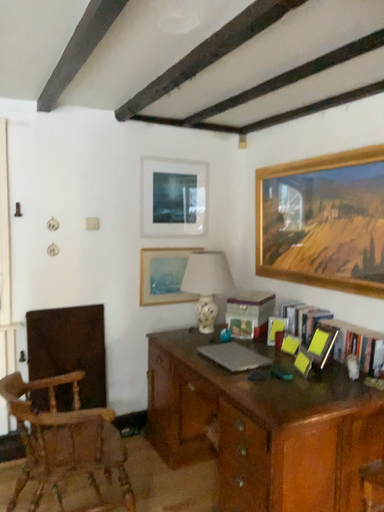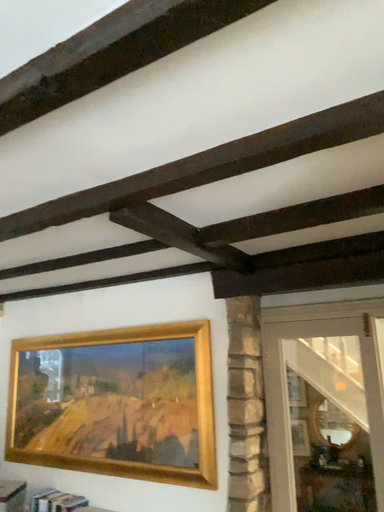
Question: Which way did the camera rotate in the video?

Choices:
 (A) rotated downward
 (B) rotated upward

Answer: (B)